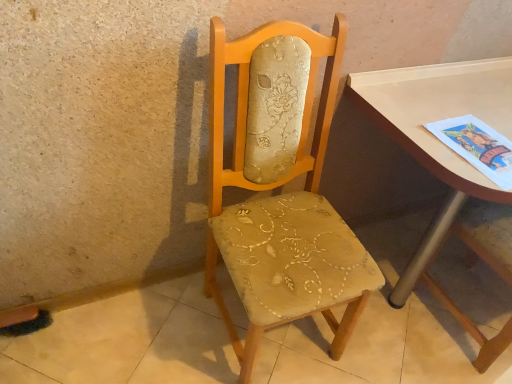
Question: Is matte beige fabric chair at center at the back of beige fabric chair at center?

Choices:
 (A) yes
 (B) no

Answer: (B)

Question: Is beige fabric chair at center shorter than matte beige fabric chair at center?

Choices:
 (A) no
 (B) yes

Answer: (B)

Question: Could matte beige fabric chair at center be considered to be inside beige fabric chair at center?

Choices:
 (A) no
 (B) yes

Answer: (A)

Question: Are beige fabric chair at center and matte beige fabric chair at center making contact?

Choices:
 (A) no
 (B) yes

Answer: (A)

Question: Considering the relative sizes of beige fabric chair at center and matte beige fabric chair at center in the image provided, is beige fabric chair at center thinner than matte beige fabric chair at center?

Choices:
 (A) yes
 (B) no

Answer: (B)

Question: Is beige fabric chair at center bigger or smaller than matte white table at right?

Choices:
 (A) big
 (B) small

Answer: (B)

Question: Relative to matte white table at right, is beige fabric chair at center in front or behind?

Choices:
 (A) behind
 (B) front

Answer: (B)

Question: From a real-world perspective, is beige fabric chair at center positioned above or below matte white table at right?

Choices:
 (A) above
 (B) below

Answer: (B)

Question: Considering the positions of beige fabric chair at center and matte white table at right in the image, is beige fabric chair at center wider or thinner than matte white table at right?

Choices:
 (A) thin
 (B) wide

Answer: (B)

Question: From the image's perspective, relative to matte beige fabric chair at center, is beige fabric chair at center above or below?

Choices:
 (A) above
 (B) below

Answer: (B)

Question: Looking at their shapes, would you say beige fabric chair at center is wider or thinner than matte beige fabric chair at center?

Choices:
 (A) wide
 (B) thin

Answer: (A)

Question: In terms of size, does beige fabric chair at center appear bigger or smaller than matte beige fabric chair at center?

Choices:
 (A) big
 (B) small

Answer: (B)

Question: From a real-world perspective, is beige fabric chair at center above or below matte beige fabric chair at center?

Choices:
 (A) above
 (B) below

Answer: (B)

Question: In the image, is matte white table at right positioned in front of or behind beige fabric chair at center?

Choices:
 (A) behind
 (B) front

Answer: (A)

Question: From a real-world perspective, is matte white table at right positioned above or below beige fabric chair at center?

Choices:
 (A) above
 (B) below

Answer: (A)